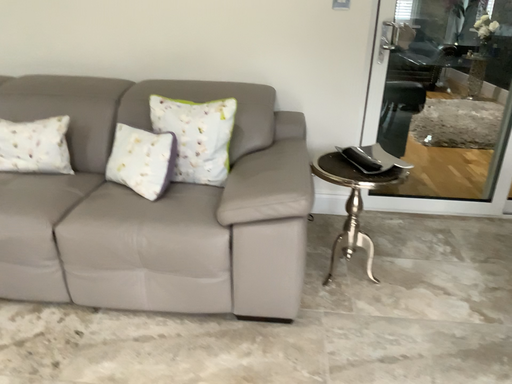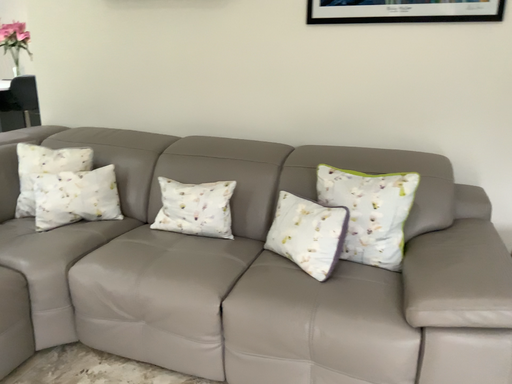
Question: Which way did the camera rotate in the video?

Choices:
 (A) rotated left
 (B) rotated right

Answer: (A)